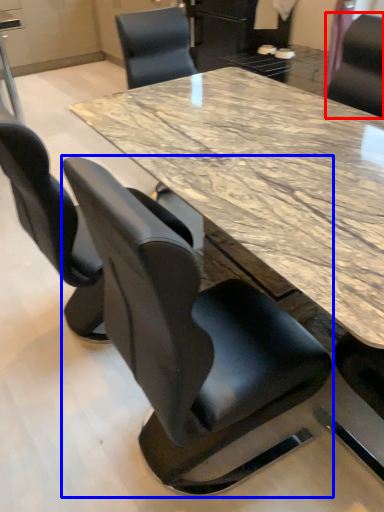
Question: Which object appears farthest to the camera in this image, chair (highlighted by a red box) or chair (highlighted by a blue box)?

Choices:
 (A) chair
 (B) chair

Answer: (A)